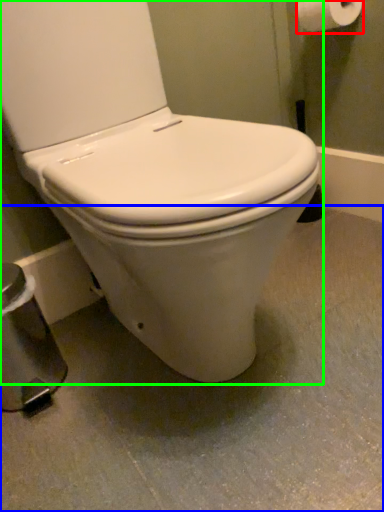
Question: Estimate the real-world distances between objects in this image. Which object is farther from toilet paper (highlighted by a red box), concrete (highlighted by a blue box) or toilet (highlighted by a green box)?

Choices:
 (A) concrete
 (B) toilet

Answer: (A)